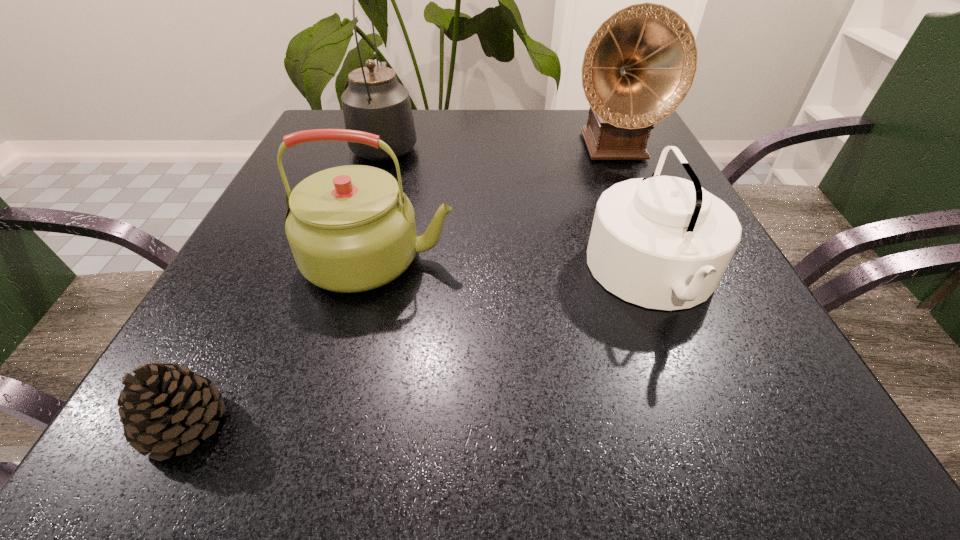
Find the location of `vacant area that lies between the phonograph record and the shortest object`. vacant area that lies between the phonograph record and the shortest object is located at coordinates (398, 286).

You are a GUI agent. You are given a task and a screenshot of the screen. Output one action in this format:
    pyautogui.click(x=<x>, y=<y>)
    Task: Click on the vacant region between the third tallest object and the nearest object
    
    Given the screenshot: What is the action you would take?
    pyautogui.click(x=281, y=341)

This screenshot has height=540, width=960. I want to click on blank region between the second shortest kettle and the second shortest object, so click(516, 267).

Locate an element on the screen. The image size is (960, 540). vacant area that lies between the fourth tallest object and the second shortest kettle is located at coordinates (516, 267).

The width and height of the screenshot is (960, 540). Identify the location of vacant area that lies between the leftmost object and the phonograph record. (398, 286).

At what (x,y) coordinates should I click in order to perform the action: click on free space between the shortest kettle and the pinecone. Please return your answer as a coordinate pair (x, y). Looking at the image, I should click on (420, 350).

The width and height of the screenshot is (960, 540). In order to click on object that is the fourth closest to the leftmost object in this screenshot , I will do `click(640, 64)`.

This screenshot has height=540, width=960. In order to click on object that stands as the fourth closest to the phonograph record in this screenshot , I will do `click(164, 406)`.

This screenshot has width=960, height=540. In order to click on kettle identified as the closest to the rightmost kettle in this screenshot , I will do `click(351, 228)`.

The height and width of the screenshot is (540, 960). I want to click on kettle that is the second nearest to the third shortest object, so click(663, 242).